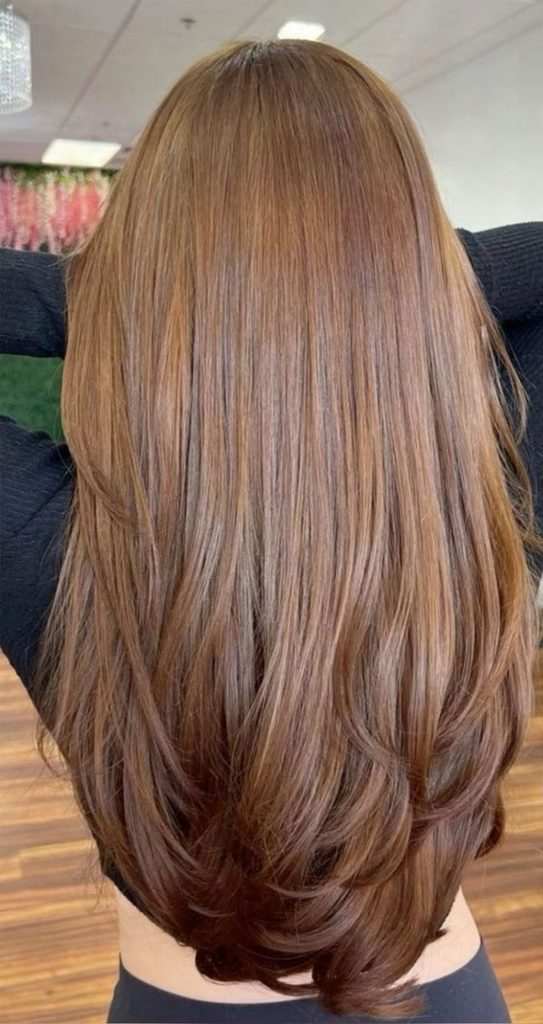
Image resolution: width=543 pixels, height=1024 pixels. In order to click on hanging crystal light in this screenshot , I will do `click(10, 20)`.